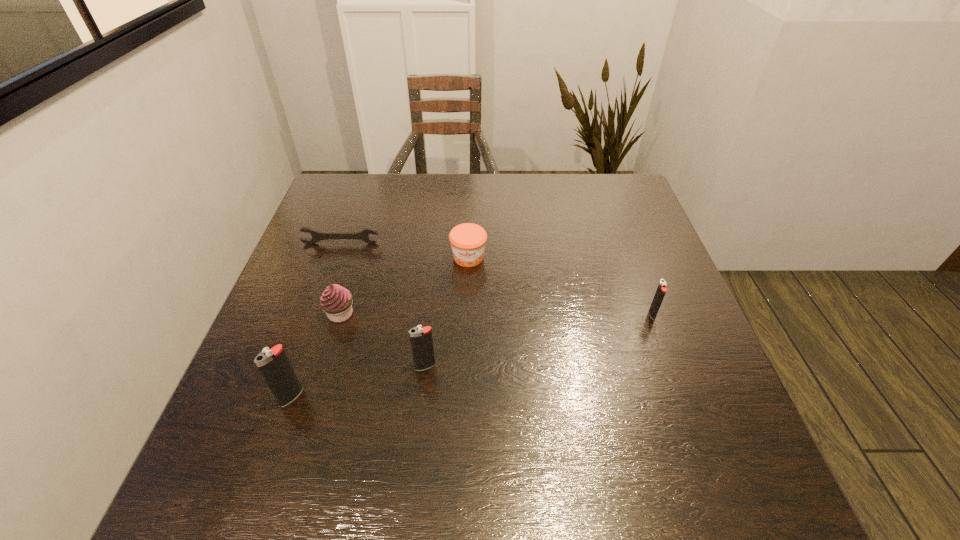
Identify the location of cupcake. The width and height of the screenshot is (960, 540). (336, 301).

The height and width of the screenshot is (540, 960). Find the location of `free space located on the back of the nearest igniter`. free space located on the back of the nearest igniter is located at coordinates (325, 299).

Find the location of a particular element. The image size is (960, 540). vacant space located 0.280m on the left of the second shortest igniter is located at coordinates (279, 366).

The width and height of the screenshot is (960, 540). In order to click on vacant space located 0.340m on the left of the rightmost igniter in this screenshot , I will do `click(500, 314)`.

The height and width of the screenshot is (540, 960). Identify the location of vacant space located 0.320m on the front label of the second farthest object. click(x=465, y=379).

Locate an element on the screen. The width and height of the screenshot is (960, 540). blank space located on the open ends of the farthest object is located at coordinates click(317, 311).

Identify the location of free space located 0.100m on the left of the cupcake. (281, 314).

Where is `object that is at the near edge`? The height and width of the screenshot is (540, 960). object that is at the near edge is located at coordinates (274, 365).

The width and height of the screenshot is (960, 540). In order to click on igniter that is at the left edge in this screenshot , I will do `click(274, 365)`.

Locate an element on the screen. wrench located at the left edge is located at coordinates (317, 236).